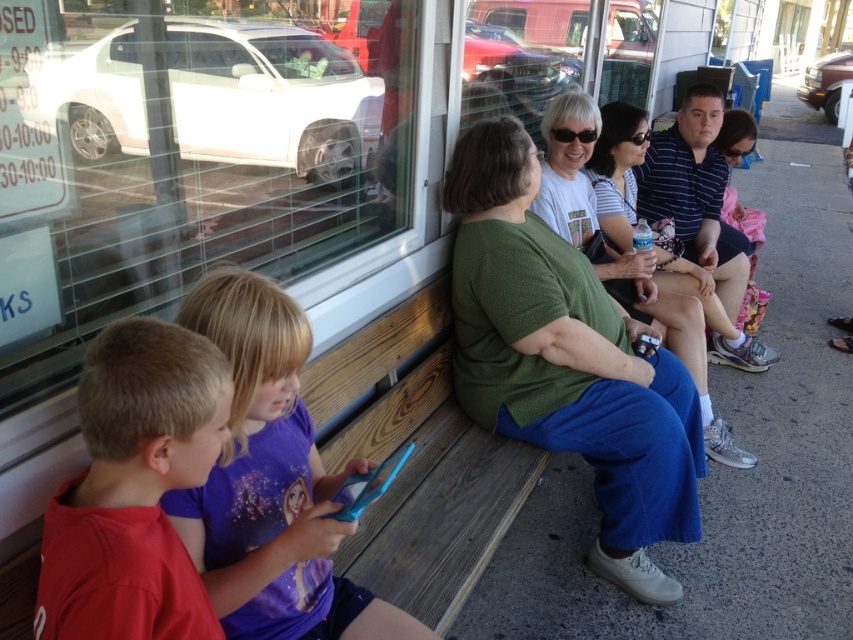
Question: From the image, what is the correct spatial relationship of transparent glass window at lower left in relation to red cotton shirt at lower left?

Choices:
 (A) left
 (B) right

Answer: (A)

Question: Based on their relative distances, which object is farther from the green textured shirt at center?

Choices:
 (A) purple fabric shirt at lower left
 (B) transparent glass window at lower left
 (C) red cotton shirt at lower left

Answer: (C)

Question: Can you confirm if green textured shirt at center is positioned above purple fabric shirt at lower left?

Choices:
 (A) yes
 (B) no

Answer: (A)

Question: Is transparent glass window at lower left to the right of green textured shirt at center from the viewer's perspective?

Choices:
 (A) yes
 (B) no

Answer: (B)

Question: Estimate the real-world distances between objects in this image. Which object is closer to the red cotton shirt at lower left?

Choices:
 (A) transparent glass window at lower left
 (B) purple fabric shirt at lower left
 (C) green textured shirt at center

Answer: (B)

Question: Which of the following is the closest to the observer?

Choices:
 (A) (590, 296)
 (B) (154, 58)
 (C) (190, 564)

Answer: (C)